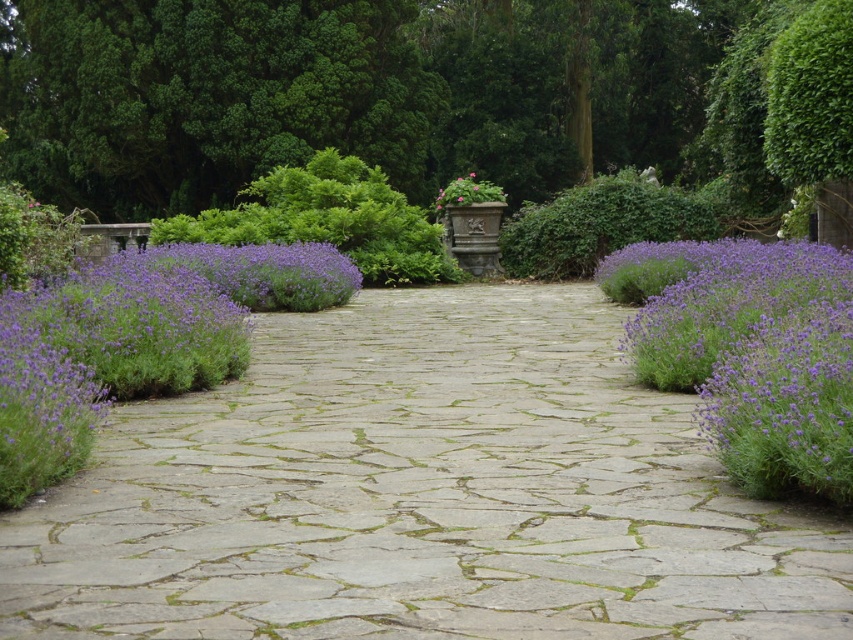
This screenshot has width=853, height=640. What do you see at coordinates (749, 352) in the screenshot? I see `purple soft lavender at right` at bounding box center [749, 352].

Does purple soft lavender at right have a greater width compared to pink matte flower pot at center?

Yes.

The height and width of the screenshot is (640, 853). In order to click on purple soft lavender at right in this screenshot , I will do `click(749, 352)`.

This screenshot has width=853, height=640. Identify the location of purple soft lavender at right. [x=749, y=352].

Is natural stone path at center thinner than pink matte flower pot at center?

In fact, natural stone path at center might be wider than pink matte flower pot at center.

You are a GUI agent. You are given a task and a screenshot of the screen. Output one action in this format:
    pyautogui.click(x=<x>, y=<y>)
    Task: Click on the natural stone path at center
    The height and width of the screenshot is (640, 853).
    Given the screenshot: What is the action you would take?
    pyautogui.click(x=421, y=493)

I want to click on natural stone path at center, so click(421, 493).

Can you confirm if natural stone path at center is thinner than purple soft lavender at right?

Incorrect, natural stone path at center's width is not less than purple soft lavender at right's.

From the picture: Can you confirm if natural stone path at center is positioned to the right of purple soft lavender at right?

No, natural stone path at center is not to the right of purple soft lavender at right.

Locate an element on the screen. Image resolution: width=853 pixels, height=640 pixels. natural stone path at center is located at coordinates (421, 493).